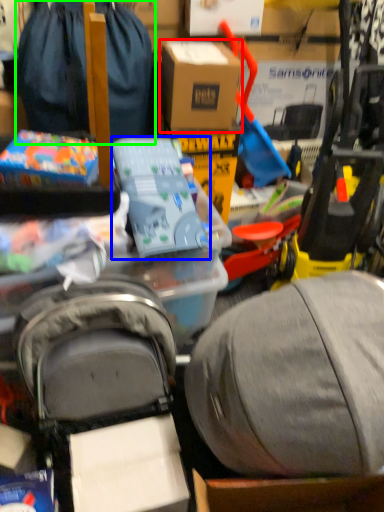
Question: Based on their relative distances, which object is farther from box (highlighted by a red box)? Choose from toy (highlighted by a blue box) and luggage and bags (highlighted by a green box).

Choices:
 (A) toy
 (B) luggage and bags

Answer: (A)